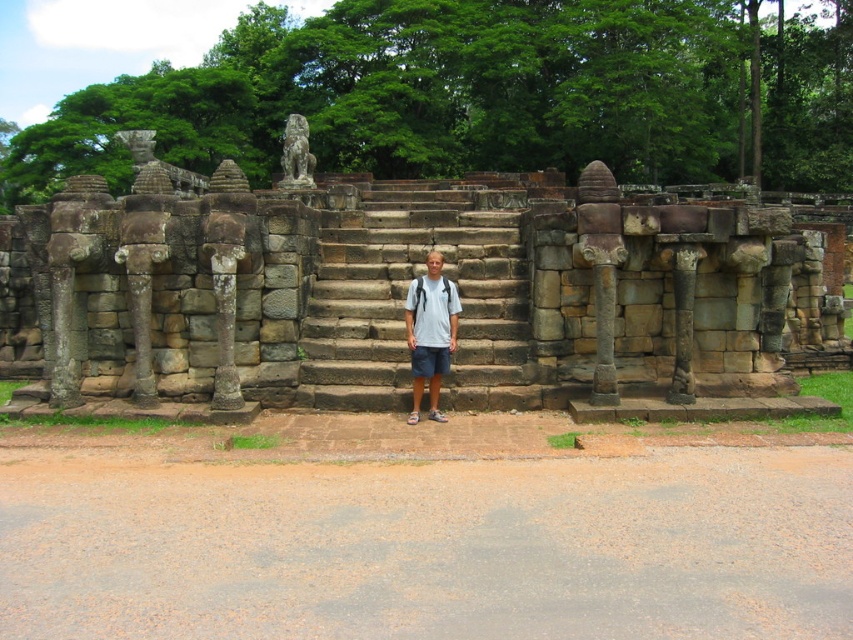
Can you confirm if brown stone stairs at center is wider than dark blue cotton shorts at center?

Yes, brown stone stairs at center is wider than dark blue cotton shorts at center.

Is brown stone stairs at center thinner than dark blue cotton shorts at center?

In fact, brown stone stairs at center might be wider than dark blue cotton shorts at center.

In the scene shown: Who is more distant from viewer, (x=341, y=400) or (x=421, y=358)?

Positioned behind is point (x=341, y=400).

Locate an element on the screen. The height and width of the screenshot is (640, 853). brown stone stairs at center is located at coordinates (405, 294).

Image resolution: width=853 pixels, height=640 pixels. What do you see at coordinates (430, 332) in the screenshot?
I see `white cotton shirt at center` at bounding box center [430, 332].

Who is more distant from viewer, (419, 384) or (438, 365)?

Point (419, 384)

Does point (434, 320) come closer to viewer compared to point (427, 348)?

That is False.

The image size is (853, 640). In order to click on white cotton shirt at center in this screenshot , I will do `click(430, 332)`.

Which is behind, point (619, 310) or point (433, 417)?

Positioned behind is point (619, 310).

Where is `stone wall at center`? The width and height of the screenshot is (853, 640). stone wall at center is located at coordinates (405, 292).

Is point (257, 237) more distant than point (430, 292)?

Yes, it is.

Where is `stone wall at center`? The height and width of the screenshot is (640, 853). stone wall at center is located at coordinates (405, 292).